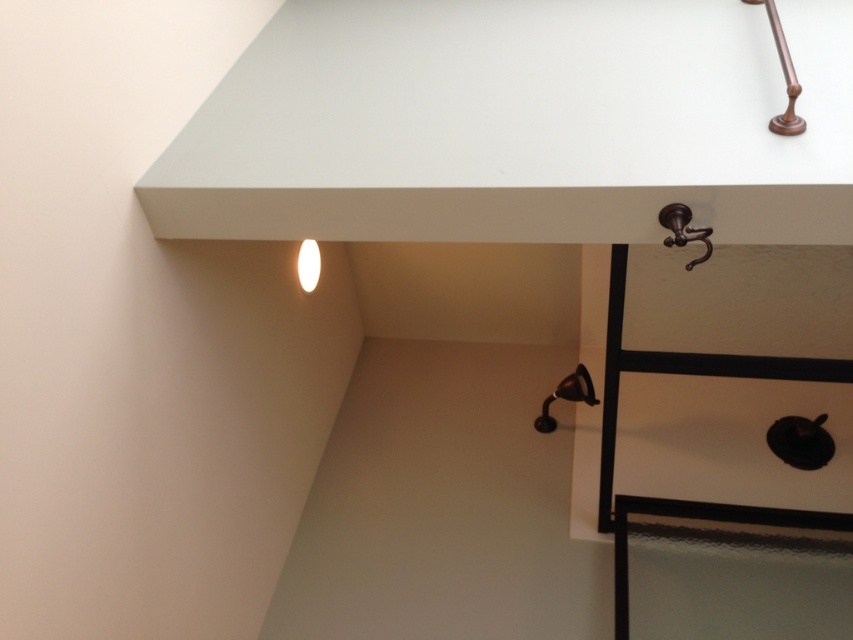
Question: Which object is the closest to the matte black lamp at center?

Choices:
 (A) white matte countertop at upper center
 (B) white glossy lamp at center
 (C) copper polished faucet at upper right

Answer: (B)

Question: Is matte black lamp at center below white glossy lamp at center?

Choices:
 (A) yes
 (B) no

Answer: (A)

Question: Which object is farther from the camera taking this photo?

Choices:
 (A) matte black lamp at center
 (B) white matte countertop at upper center
 (C) copper polished faucet at upper right

Answer: (A)

Question: Which of the following is the closest to the observer?

Choices:
 (A) (538, 419)
 (B) (776, 125)

Answer: (B)

Question: Is white matte countertop at upper center in front of copper polished faucet at upper right?

Choices:
 (A) yes
 (B) no

Answer: (A)

Question: Can you confirm if white matte countertop at upper center is thinner than matte black lamp at center?

Choices:
 (A) yes
 (B) no

Answer: (B)